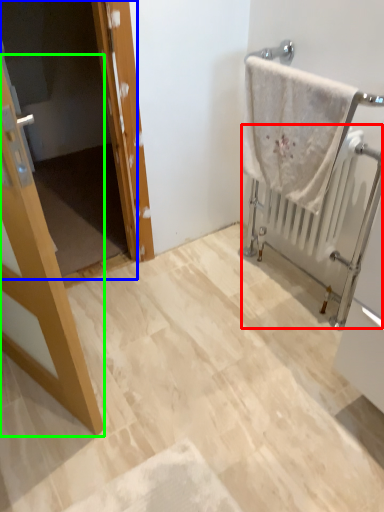
Question: Estimate the real-world distances between objects in this image. Which object is closer to radiator (highlighted by a red box), screen door (highlighted by a blue box) or door (highlighted by a green box)?

Choices:
 (A) screen door
 (B) door

Answer: (B)